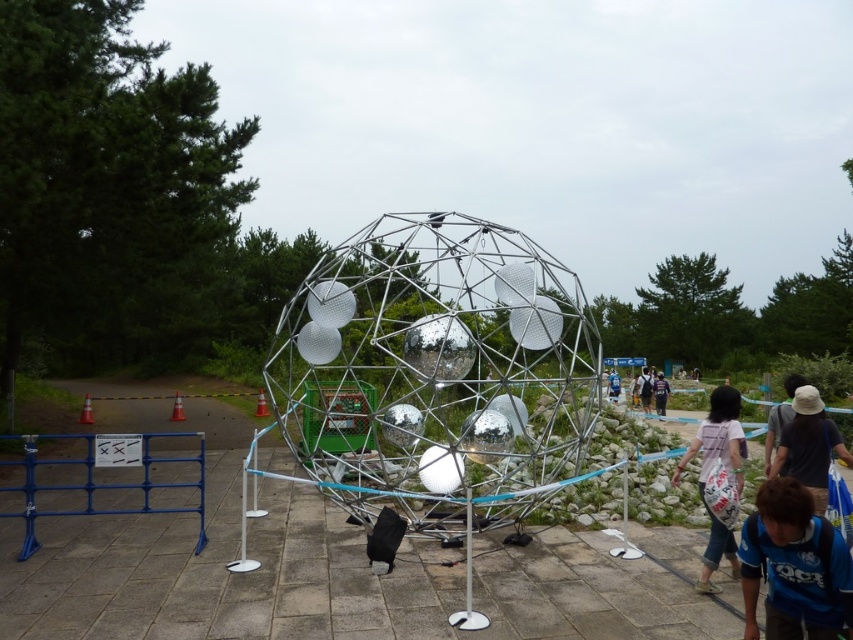
You are a visitor at the geodesic dome exhibit and want to place both the dark gray fabric bag at lower right and the purple fabric bag at center on a shelf that can only hold items up to 1 meter in height. Based on their sizes, which bag should you avoid placing on the shelf?

The dark gray fabric bag at lower right is much taller than the purple fabric bag at center, so you should avoid placing the dark gray fabric bag at lower right on the shelf since it exceeds the height limit.

You are standing at the entrance of the geodesic dome and see a dark blue shirt at center and a purple fabric bag at center. Which item is located to the right of the other?

The dark blue shirt at center is positioned on the right side of purple fabric bag at center.

You are standing near the base of the geodesic dome and see both the dark gray fabric bag at lower right and the purple fabric bag at center. Which bag is positioned further to the left side of the scene?

The dark gray fabric bag at lower right is positioned further to the left side of the scene compared to the purple fabric bag at center.